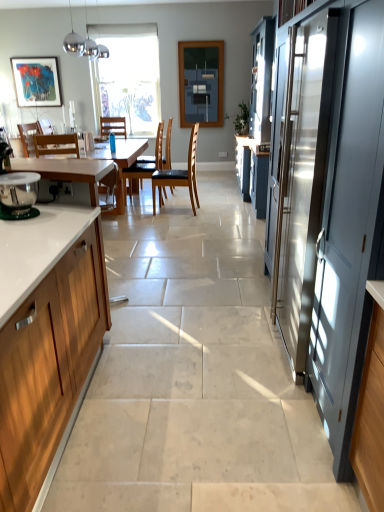
The height and width of the screenshot is (512, 384). Find the location of `vacant area that lies to the right of black leather chair at center, placed as the first chair when sorted from right to left`. vacant area that lies to the right of black leather chair at center, placed as the first chair when sorted from right to left is located at coordinates (211, 210).